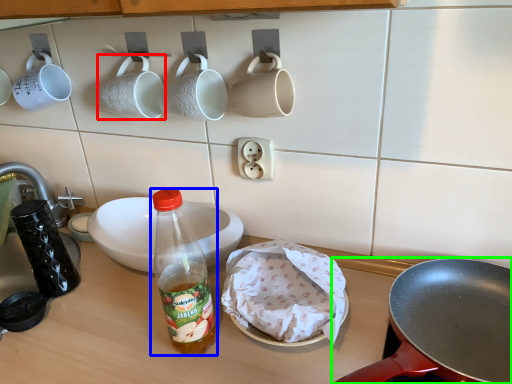
Question: Based on their relative distances, which object is nearer to coffee cup (highlighted by a red box)? Choose from bottle (highlighted by a blue box) and frying pan (highlighted by a green box).

Choices:
 (A) bottle
 (B) frying pan

Answer: (A)